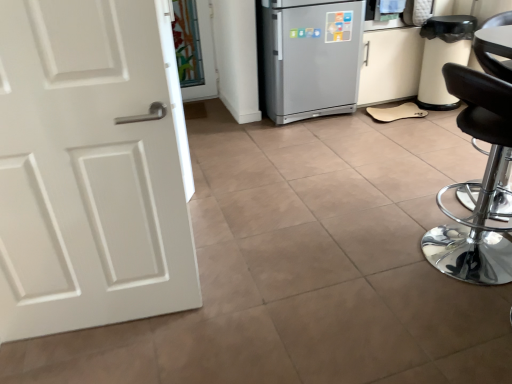
Describe the element at coordinates (476, 185) in the screenshot. The height and width of the screenshot is (384, 512). I see `black leather stool at right` at that location.

This screenshot has width=512, height=384. What are the coordinates of `transparent glass door at upper center` in the screenshot? It's located at (187, 43).

Locate an element on the screen. This screenshot has height=384, width=512. white matte cabinet at right is located at coordinates (390, 65).

Measure the distance between point (369, 32) and camera.

Point (369, 32) and camera are 3.23 meters apart.

Locate an element on the screen. Image resolution: width=512 pixels, height=384 pixels. black leather stool at right is located at coordinates tap(476, 185).

Find the location of a particular element. cabinetry located above the transparent glass door at upper center (from a real-world perspective) is located at coordinates (390, 65).

From a real-world perspective, is transparent glass door at upper center above or below white matte cabinet at right?

From a real-world perspective, transparent glass door at upper center is physically below white matte cabinet at right.

Is transparent glass door at upper center taller or shorter than white matte cabinet at right?

Considering their sizes, transparent glass door at upper center has more height than white matte cabinet at right.

Is white matte cabinet at right at the back of transparent glass door at upper center?

transparent glass door at upper center is not turned away from white matte cabinet at right.

Identify the location of chair below the silver metallic refrigerator at center (from a real-world perspective). (476, 185).

Which of these two, silver metallic refrigerator at center or black leather stool at right, is bigger?

Bigger between the two is black leather stool at right.

Does silver metallic refrigerator at center have a greater height compared to black leather stool at right?

No.

Which object is wider, white matte cabinet at right or transparent glass door at upper center?

Wider between the two is white matte cabinet at right.

Who is shorter, white matte cabinet at right or transparent glass door at upper center?

white matte cabinet at right.

Consider the image. Which is correct: white matte cabinet at right is inside transparent glass door at upper center, or outside of it?

white matte cabinet at right lies outside transparent glass door at upper center.

Does black leather stool at right contain silver metallic refrigerator at center?

No, silver metallic refrigerator at center is located outside of black leather stool at right.

Between black leather stool at right and silver metallic refrigerator at center, which one has more height?

Standing taller between the two is black leather stool at right.

You are a GUI agent. You are given a task and a screenshot of the screen. Output one action in this format:
    pyautogui.click(x=<x>, y=<y>)
    Task: Click on the chair beneath the silver metallic refrigerator at center (from a real-world perspective)
    The height and width of the screenshot is (384, 512).
    Given the screenshot: What is the action you would take?
    pyautogui.click(x=476, y=185)

Which is closer to the camera, (497, 239) or (311, 49)?

Point (497, 239).

From a real-world perspective, is silver metallic refrigerator at center physically located above or below transparent glass door at upper center?

silver metallic refrigerator at center is above transparent glass door at upper center.

Is silver metallic refrigerator at center oriented away from transparent glass door at upper center?

No, silver metallic refrigerator at center's orientation is not away from transparent glass door at upper center.

Relative to transparent glass door at upper center, is silver metallic refrigerator at center in front or behind?

In the image, silver metallic refrigerator at center appears in front of transparent glass door at upper center.

Between black leather stool at right and white matte cabinet at right, which one appears on the left side from the viewer's perspective?

From the viewer's perspective, white matte cabinet at right appears more on the left side.

Based on the photo, from a real-world perspective, is black leather stool at right positioned above or below white matte cabinet at right?

In terms of real-world spatial position, black leather stool at right is above white matte cabinet at right.

Is black leather stool at right inside or outside of white matte cabinet at right?

black leather stool at right exists outside the volume of white matte cabinet at right.

How different are the orientations of black leather stool at right and white matte cabinet at right in degrees?

The angular difference between black leather stool at right and white matte cabinet at right is 91.6 degrees.

Can you see black leather stool at right touching transparent glass door at upper center?

No, black leather stool at right is not making contact with transparent glass door at upper center.

The width and height of the screenshot is (512, 384). What are the coordinates of `glass door located above the black leather stool at right (from the image's perspective)` in the screenshot? It's located at (187, 43).

From a real-world perspective, is black leather stool at right above or below transparent glass door at upper center?

In terms of real-world spatial position, black leather stool at right is above transparent glass door at upper center.

The width and height of the screenshot is (512, 384). What are the coordinates of `glass door located underneath the white matte cabinet at right (from a real-world perspective)` in the screenshot? It's located at (187, 43).

Where is `chair that appears on the right of silver metallic refrigerator at center`? chair that appears on the right of silver metallic refrigerator at center is located at coordinates (476, 185).

From the picture: From the image, which object appears to be nearer to white matte cabinet at right, transparent glass door at upper center or black leather stool at right?

transparent glass door at upper center lies closer to white matte cabinet at right than the other object.

Based on their spatial positions, is white matte cabinet at right or silver metallic refrigerator at center closer to black leather stool at right?

silver metallic refrigerator at center is closer to black leather stool at right.

Which object lies further to the anchor point silver metallic refrigerator at center, white matte cabinet at right or black leather stool at right?

Among the two, black leather stool at right is located further to silver metallic refrigerator at center.

When comparing their distances from transparent glass door at upper center, does black leather stool at right or white matte cabinet at right seem closer?

white matte cabinet at right is positioned closer to the anchor transparent glass door at upper center.

When comparing their distances from transparent glass door at upper center, does white matte cabinet at right or black leather stool at right seem closer?

white matte cabinet at right lies closer to transparent glass door at upper center than the other object.

Based on their spatial positions, is silver metallic refrigerator at center or black leather stool at right further from transparent glass door at upper center?

The object further to transparent glass door at upper center is black leather stool at right.

From the image, which object appears to be nearer to white matte cabinet at right, black leather stool at right or silver metallic refrigerator at center?

silver metallic refrigerator at center lies closer to white matte cabinet at right than the other object.

Estimate the real-world distances between objects in this image. Which object is further from white matte cabinet at right, black leather stool at right or transparent glass door at upper center?

black leather stool at right is positioned further to the anchor white matte cabinet at right.

Identify the location of refrigerator between black leather stool at right and transparent glass door at upper center along the z-axis. This screenshot has height=384, width=512. (311, 57).

Find the location of a particular element. cabinetry between black leather stool at right and transparent glass door at upper center in the front-back direction is located at coordinates point(390,65).

What are the coordinates of `refrigerator positioned between black leather stool at right and white matte cabinet at right from near to far` in the screenshot? It's located at (311, 57).

This screenshot has width=512, height=384. Identify the location of refrigerator between transparent glass door at upper center and white matte cabinet at right. (311, 57).